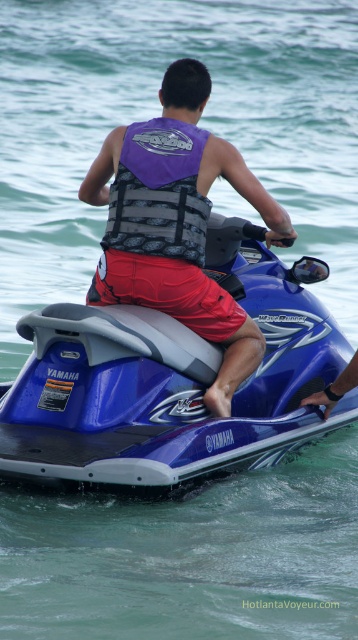
You are a lifeguard observing a person wearing both a purple fabric life vest at center and a purple fabric life jacket at center while riding a Yamaha WaveRunner jet ski. Which one of these items is larger?

The purple fabric life vest at center is bigger than the purple fabric life jacket at center, so the life vest is larger.

You are a photographer positioned on a boat observing the scene. You need to capture a photo where both the blue metallic jet ski at center and the purple fabric life vest at center are visible. Based on their positions, which object should you adjust your camera to focus on first to ensure both are in frame?

The blue metallic jet ski at center is to the right of the purple fabric life vest at center. To ensure both are in frame, focus on the purple fabric life vest at center first since it is on the left, allowing the jet ski to naturally fall into the right side of the frame.

You are a lifeguard observing a swimmer wearing a purple fabric life vest at center and a purple fabric life jacket at center. Which one is taller?

The purple fabric life vest at center is much taller than the purple fabric life jacket at center.